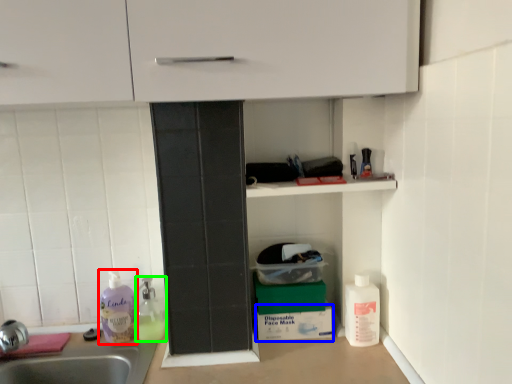
Question: Considering the real-world distances, which object is farthest from cleaning product (highlighted by a red box)? cardboard box (highlighted by a blue box) or cleaning product (highlighted by a green box)?

Choices:
 (A) cardboard box
 (B) cleaning product

Answer: (A)